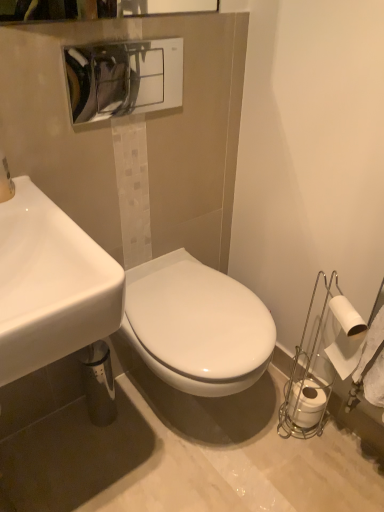
Describe the element at coordinates (124, 78) in the screenshot. I see `matte white hand dryer at upper center` at that location.

Locate an element on the screen. This screenshot has width=384, height=512. white matte toilet paper at lower right, the first toilet paper from the bottom is located at coordinates (307, 403).

Where is `white glossy sink at center, which is the first sink in back-to-front order`? The image size is (384, 512). white glossy sink at center, which is the first sink in back-to-front order is located at coordinates (121, 304).

Where is `white matte toilet paper at lower right, the second toilet paper from the back`? This screenshot has height=512, width=384. white matte toilet paper at lower right, the second toilet paper from the back is located at coordinates (346, 337).

Is white matte toilet paper at lower right, the first toilet paper positioned from the front, wider or thinner than white matte toilet paper at lower right, which is the 1th toilet paper from back to front?

white matte toilet paper at lower right, the first toilet paper positioned from the front, is thinner than white matte toilet paper at lower right, which is the 1th toilet paper from back to front.

Which of these two, white matte toilet paper at lower right, the first toilet paper positioned from the front, or white matte toilet paper at lower right, which is counted as the 2th toilet paper, starting from the top, stands shorter?

white matte toilet paper at lower right, which is counted as the 2th toilet paper, starting from the top, is shorter.

Is white matte toilet paper at lower right, the first toilet paper positioned from the front, touching white matte toilet paper at lower right, which is counted as the 2th toilet paper, starting from the top?

They are not placed beside each other.

Considering the positions of objects white matte toilet paper at lower right, the second toilet paper from the back, and white matte toilet paper at lower right, the first toilet paper from the bottom, in the image provided, who is more to the right, white matte toilet paper at lower right, the second toilet paper from the back, or white matte toilet paper at lower right, the first toilet paper from the bottom,?

white matte toilet paper at lower right, the second toilet paper from the back, is more to the right.

Is white matte toilet paper at lower right, which is counted as the 2th toilet paper, starting from the top, completely or partially outside of white glossy sink at left, the 2th sink viewed from the back?

Yes, white matte toilet paper at lower right, which is counted as the 2th toilet paper, starting from the top, is not within white glossy sink at left, the 2th sink viewed from the back.

Which is in front, point (296, 390) or point (53, 219)?

The point (53, 219) is closer to the camera.

Considering the sizes of white matte toilet paper at lower right, which is counted as the 2th toilet paper, starting from the top, and white glossy sink at left, the 2th sink viewed from the back, in the image, is white matte toilet paper at lower right, which is counted as the 2th toilet paper, starting from the top, wider or thinner than white glossy sink at left, the 2th sink viewed from the back,?

Considering their sizes, white matte toilet paper at lower right, which is counted as the 2th toilet paper, starting from the top, looks slimmer than white glossy sink at left, the 2th sink viewed from the back.

From a real-world perspective, who is located higher, white matte toilet paper at lower right, which is counted as the 2th toilet paper, starting from the top, or white glossy sink at left, the 2th sink viewed from the back?

white glossy sink at left, the 2th sink viewed from the back, is physically above.

From a real-world perspective, is matte white hand dryer at upper center positioned under white glossy sink at left, the 2th sink viewed from the back, based on gravity?

No, from a real-world perspective, matte white hand dryer at upper center is not under white glossy sink at left, the 2th sink viewed from the back.

Looking at this image, is matte white hand dryer at upper center surrounding white glossy sink at left, the 1th sink when ordered from front to back?

Definitely not — white glossy sink at left, the 1th sink when ordered from front to back, is not inside matte white hand dryer at upper center.

Is matte white hand dryer at upper center looking in the opposite direction of white glossy sink at left, the 2th sink viewed from the back?

matte white hand dryer at upper center does not have its back to white glossy sink at left, the 2th sink viewed from the back.

How far apart are matte white hand dryer at upper center and white glossy sink at left, the 2th sink viewed from the back?

A distance of 20.18 inches exists between matte white hand dryer at upper center and white glossy sink at left, the 2th sink viewed from the back.

Is matte white hand dryer at upper center a part of white glossy sink at left, the 1th sink when ordered from front to back?

No, matte white hand dryer at upper center is not inside white glossy sink at left, the 1th sink when ordered from front to back.

Does white glossy sink at left, the 2th sink viewed from the back, appear on the right side of matte white hand dryer at upper center?

No.

Could you tell me if white glossy sink at left, the 2th sink viewed from the back, is turned towards matte white hand dryer at upper center?

No, white glossy sink at left, the 2th sink viewed from the back, is not aimed at matte white hand dryer at upper center.

Which of these two, white matte toilet paper at lower right, which is the 1th toilet paper from back to front, or matte white hand dryer at upper center, stands taller?

Standing taller between the two is matte white hand dryer at upper center.

Based on the photo, is white matte toilet paper at lower right, the first toilet paper from the bottom, oriented towards matte white hand dryer at upper center?

No, white matte toilet paper at lower right, the first toilet paper from the bottom, does not turn towards matte white hand dryer at upper center.

Would you say white matte toilet paper at lower right, which is the 1th toilet paper from back to front, is outside matte white hand dryer at upper center?

Yes, white matte toilet paper at lower right, which is the 1th toilet paper from back to front, is located beyond the bounds of matte white hand dryer at upper center.

Considering the sizes of objects white matte toilet paper at lower right, the first toilet paper from the bottom, and matte white hand dryer at upper center in the image provided, who is wider, white matte toilet paper at lower right, the first toilet paper from the bottom, or matte white hand dryer at upper center?

With larger width is white matte toilet paper at lower right, the first toilet paper from the bottom.

Who is more distant, matte white hand dryer at upper center or white matte toilet paper at lower right, the second toilet paper from the back?

white matte toilet paper at lower right, the second toilet paper from the back, is further from the camera.

Visually, is matte white hand dryer at upper center positioned to the left or to the right of white matte toilet paper at lower right, the second toilet paper from the back?

matte white hand dryer at upper center is to the left of white matte toilet paper at lower right, the second toilet paper from the back.

How different are the orientations of matte white hand dryer at upper center and white matte toilet paper at lower right, the second toilet paper from the back, in degrees?

There is a 115-degree angle between the facing directions of matte white hand dryer at upper center and white matte toilet paper at lower right, the second toilet paper from the back.

Choose the correct answer: Is matte white hand dryer at upper center inside white matte toilet paper at lower right, the second toilet paper in the bottom-to-top sequence, or outside it?

matte white hand dryer at upper center is outside white matte toilet paper at lower right, the second toilet paper in the bottom-to-top sequence.

Is white glossy sink at center, the 2th sink in the front-to-back sequence, positioned beyond the bounds of white glossy sink at left, the 2th sink viewed from the back?

white glossy sink at center, the 2th sink in the front-to-back sequence, is positioned outside white glossy sink at left, the 2th sink viewed from the back.

At what (x,y) coordinates should I click in order to perform the action: click on sink directly beneath the white glossy sink at left, the 1th sink when ordered from front to back (from a real-world perspective). Please return your answer as a coordinate pair (x, y). Looking at the image, I should click on (121, 304).

From a real-world perspective, does white glossy sink at center, the 2th sink in the front-to-back sequence, sit lower than white glossy sink at left, the 2th sink viewed from the back?

Yes.

Is point (61, 304) closer or farther from the camera than point (27, 224)?

Point (61, 304).

This screenshot has height=512, width=384. In the image, there is a white matte toilet paper at lower right, the second toilet paper from the back. What are the coordinates of `toilet paper below it (from a real-world perspective)` in the screenshot? It's located at (307, 403).

From the white matte toilet paper at lower right, which appears as the 2th toilet paper when viewed from the front, count the 2nd sink to the left and point to it. Please provide its 2D coordinates.

[(51, 284)]

From the image, which object appears to be farther from white matte toilet paper at lower right, which is the 1th toilet paper from back to front, matte white hand dryer at upper center or white glossy sink at left, the 2th sink viewed from the back?

The object further to white matte toilet paper at lower right, which is the 1th toilet paper from back to front, is matte white hand dryer at upper center.

When comparing their distances from white glossy sink at center, which is the first sink in back-to-front order, does white matte toilet paper at lower right, which is counted as the 2th toilet paper, starting from the top, or matte white hand dryer at upper center seem further?

matte white hand dryer at upper center.

Which object lies further to the anchor point white glossy sink at center, the 2th sink in the front-to-back sequence, white glossy sink at left, the 2th sink viewed from the back, or white matte toilet paper at lower right, the first toilet paper in the top-to-bottom sequence?

white glossy sink at left, the 2th sink viewed from the back, is positioned further to the anchor white glossy sink at center, the 2th sink in the front-to-back sequence.

Considering their positions, is white matte toilet paper at lower right, which appears as the 2th toilet paper when viewed from the front, positioned further to white matte toilet paper at lower right, the first toilet paper in the top-to-bottom sequence, than white glossy sink at center, the 2th sink in the front-to-back sequence?

white matte toilet paper at lower right, which appears as the 2th toilet paper when viewed from the front, is positioned further to the anchor white matte toilet paper at lower right, the first toilet paper in the top-to-bottom sequence.

When comparing their distances from white matte toilet paper at lower right, the first toilet paper in the top-to-bottom sequence, does white glossy sink at center, the 2th sink in the front-to-back sequence, or white glossy sink at left, the 1th sink when ordered from front to back, seem further?

white glossy sink at left, the 1th sink when ordered from front to back, lies further to white matte toilet paper at lower right, the first toilet paper in the top-to-bottom sequence, than the other object.

Which object lies further to the anchor point white matte toilet paper at lower right, which appears as the 2th toilet paper when viewed from the front, white glossy sink at center, which is the first sink in back-to-front order, or matte white hand dryer at upper center?

matte white hand dryer at upper center is further to white matte toilet paper at lower right, which appears as the 2th toilet paper when viewed from the front.

Based on the photo, estimate the real-world distances between objects in this image. Which object is closer to matte white hand dryer at upper center, white glossy sink at left, the 2th sink viewed from the back, or white matte toilet paper at lower right, which appears as the 2th toilet paper when viewed from the front?

Based on the image, white glossy sink at left, the 2th sink viewed from the back, appears to be nearer to matte white hand dryer at upper center.

Looking at the image, which one is located further to matte white hand dryer at upper center, white matte toilet paper at lower right, the second toilet paper from the back, or white matte toilet paper at lower right, which appears as the 2th toilet paper when viewed from the front?

white matte toilet paper at lower right, which appears as the 2th toilet paper when viewed from the front, lies further to matte white hand dryer at upper center than the other object.

What are the coordinates of `sink between white glossy sink at left, the 1th sink when ordered from front to back, and white matte toilet paper at lower right, which is the 1th toilet paper from back to front, from front to back` in the screenshot? It's located at (121, 304).

Identify the location of hand dryer situated between white glossy sink at center, the 2th sink in the front-to-back sequence, and white matte toilet paper at lower right, the second toilet paper in the bottom-to-top sequence, from left to right. (124, 78).

The image size is (384, 512). Identify the location of toilet paper located between white glossy sink at center, which is the first sink in back-to-front order, and white matte toilet paper at lower right, the second toilet paper from the back, in the left-right direction. (307, 403).

Locate an element on the screen. This screenshot has width=384, height=512. toilet paper between matte white hand dryer at upper center and white matte toilet paper at lower right, which appears as the 2th toilet paper when viewed from the front, in the vertical direction is located at coordinates (346, 337).